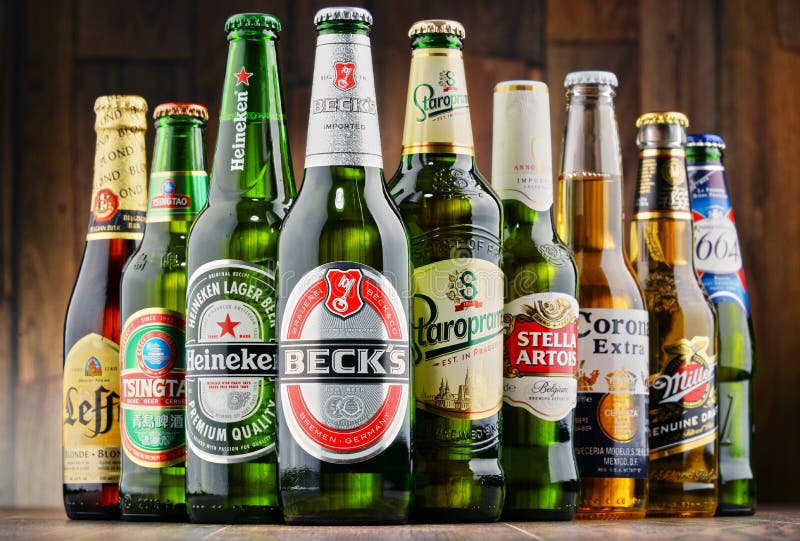
Locate an element on the screen. beer bottles is located at coordinates (94, 395), (152, 382), (334, 358), (234, 375), (440, 361), (536, 346), (614, 361), (672, 377), (720, 373).